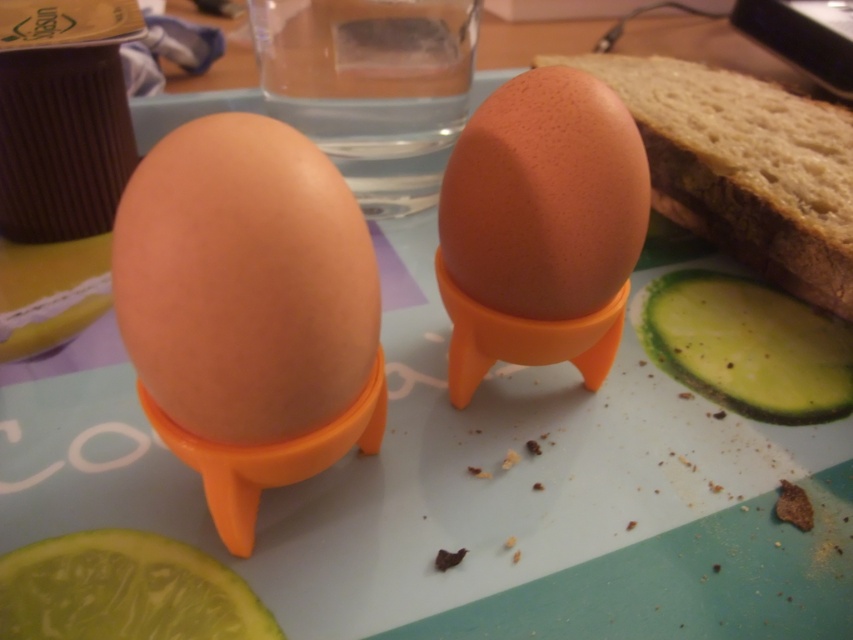
Question: Among these objects, which one is farthest from the camera?

Choices:
 (A) green matte pickle at lower left
 (B) matte brown egg at center

Answer: (A)

Question: Which point is farther to the camera?

Choices:
 (A) green matte pickle at lower left
 (B) matte brown egg at center
 (C) brown matte egg at center
 (D) green matte cucumber at right

Answer: (D)

Question: Which point appears farthest from the camera in this image?

Choices:
 (A) (509, 275)
 (B) (252, 611)
 (C) (839, 202)
 (D) (657, 339)

Answer: (C)

Question: In this image, where is matte brown egg at center located relative to brown matte bread at upper right?

Choices:
 (A) above
 (B) below

Answer: (B)

Question: Is green matte pickle at lower left to the left of green matte cucumber at right from the viewer's perspective?

Choices:
 (A) no
 (B) yes

Answer: (B)

Question: Is brown matte egg at center to the right of green matte cucumber at right from the viewer's perspective?

Choices:
 (A) yes
 (B) no

Answer: (B)